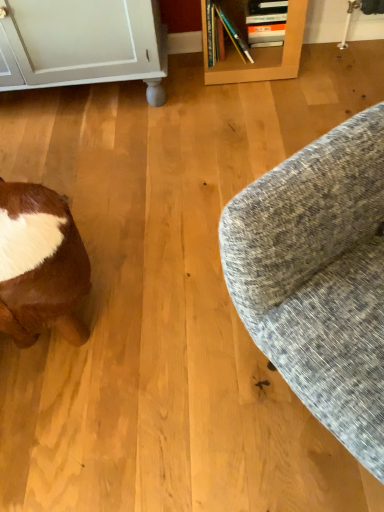
Question: Considering the relative positions of brown fur at lower left and textured gray fabric couch at right in the image provided, is brown fur at lower left to the left or to the right of textured gray fabric couch at right?

Choices:
 (A) left
 (B) right

Answer: (A)

Question: From their relative heights in the image, would you say brown fur at lower left is taller or shorter than textured gray fabric couch at right?

Choices:
 (A) tall
 (B) short

Answer: (B)

Question: From the image's perspective, relative to textured gray fabric couch at right, is brown fur at lower left above or below?

Choices:
 (A) above
 (B) below

Answer: (B)

Question: Considering their positions, is textured gray fabric couch at right located in front of or behind brown fur at lower left?

Choices:
 (A) behind
 (B) front

Answer: (B)

Question: In terms of height, does textured gray fabric couch at right look taller or shorter compared to brown fur at lower left?

Choices:
 (A) tall
 (B) short

Answer: (A)

Question: In terms of size, does textured gray fabric couch at right appear bigger or smaller than brown fur at lower left?

Choices:
 (A) small
 (B) big

Answer: (B)

Question: From a real-world perspective, relative to brown fur at lower left, is textured gray fabric couch at right vertically above or below?

Choices:
 (A) above
 (B) below

Answer: (A)